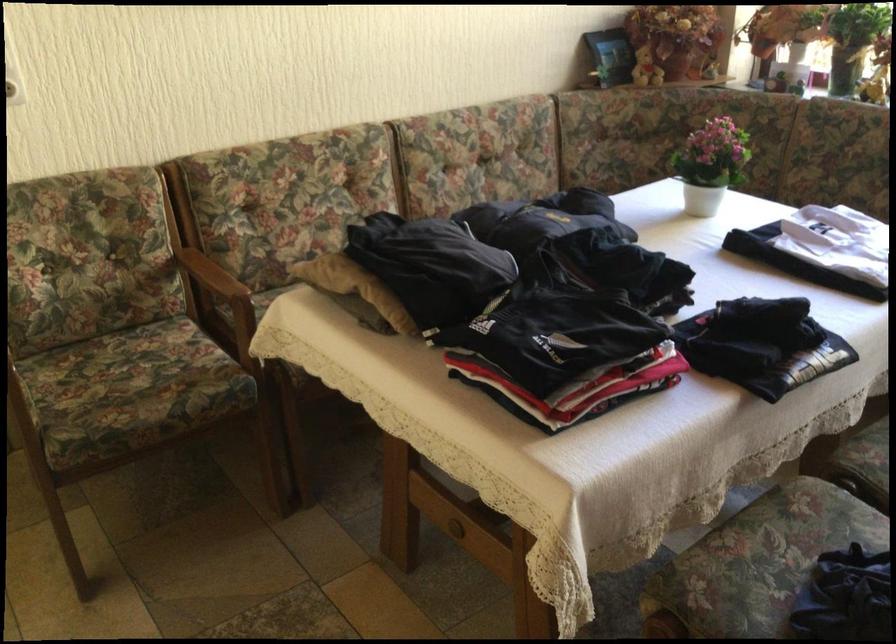
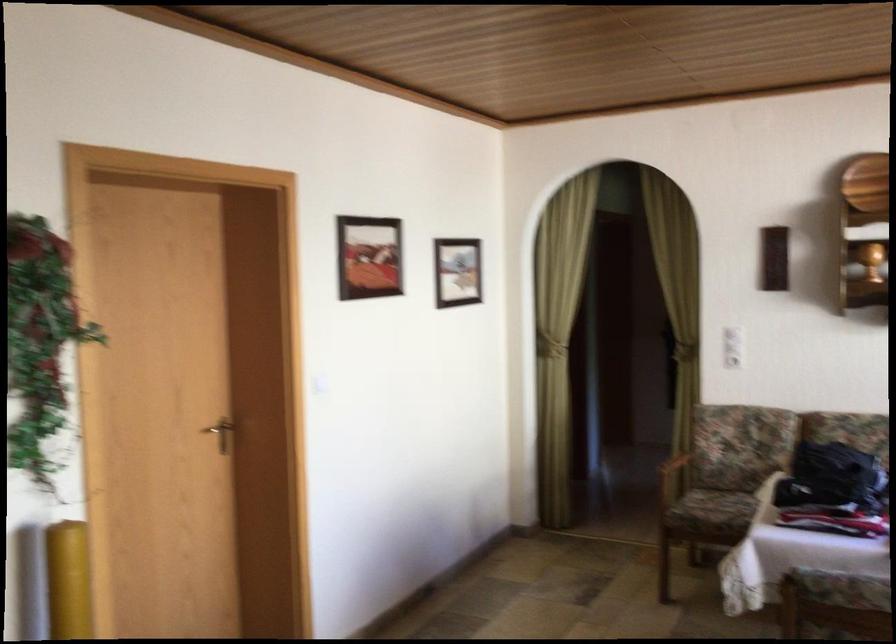
In the second image, find the point that corresponds to (142,389) in the first image.

(725, 507)